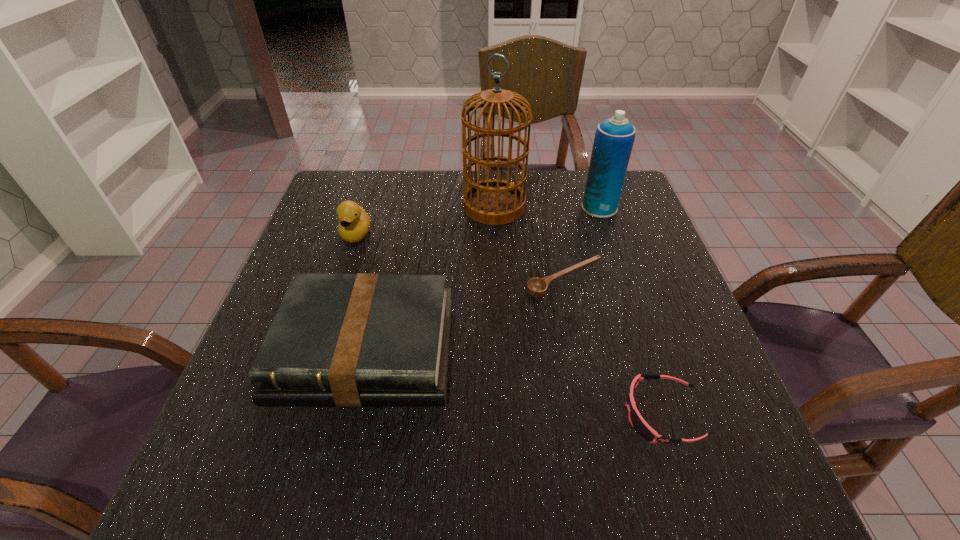
Image resolution: width=960 pixels, height=540 pixels. Find the location of `goggles that is at the right edge`. goggles that is at the right edge is located at coordinates (638, 423).

Image resolution: width=960 pixels, height=540 pixels. In order to click on object positioned at the far right corner in this screenshot , I will do `click(614, 137)`.

Find the location of `free space at the far edge of the desktop`. free space at the far edge of the desktop is located at coordinates (468, 172).

The image size is (960, 540). I want to click on vacant space at the left edge of the desktop, so click(361, 247).

Locate an element on the screen. The width and height of the screenshot is (960, 540). free spot at the right edge of the desktop is located at coordinates (625, 250).

In the image, there is a desktop. Identify the location of free region at the far left corner. (374, 190).

You are a GUI agent. You are given a task and a screenshot of the screen. Output one action in this format:
    pyautogui.click(x=<x>, y=<y>)
    Task: Click on the vacant region at the near right corner of the desktop
    This screenshot has height=540, width=960.
    Given the screenshot: What is the action you would take?
    pyautogui.click(x=770, y=494)

At what (x,y) coordinates should I click in order to perform the action: click on free point between the fifth shortest object and the shortest object. Please return your answer as a coordinate pair (x, y). Looking at the image, I should click on (582, 244).

This screenshot has height=540, width=960. What are the coordinates of `vacant area that lies between the second shortest object and the hardback book` in the screenshot? It's located at (514, 382).

Find the location of a particular element. This screenshot has width=960, height=540. free space between the goggles and the duckling is located at coordinates (509, 324).